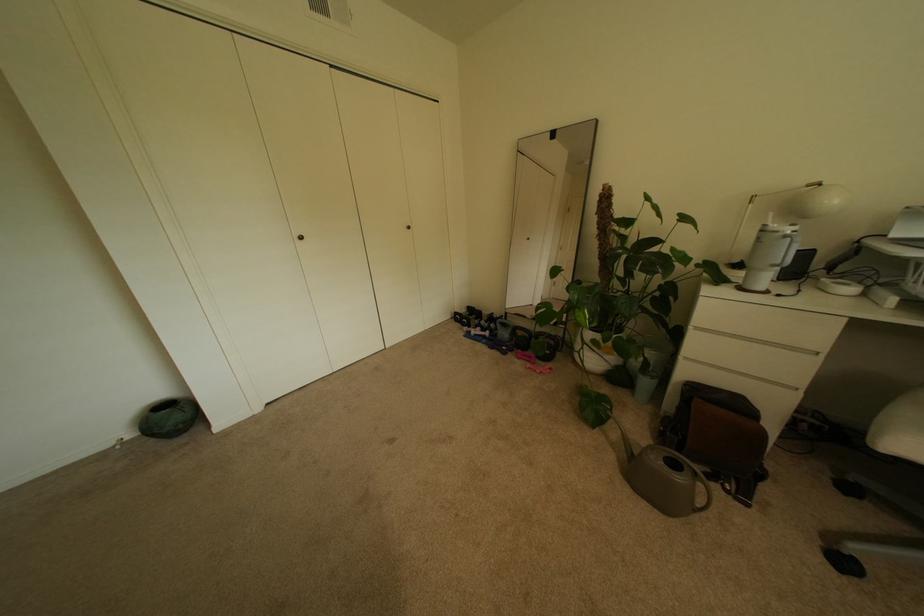
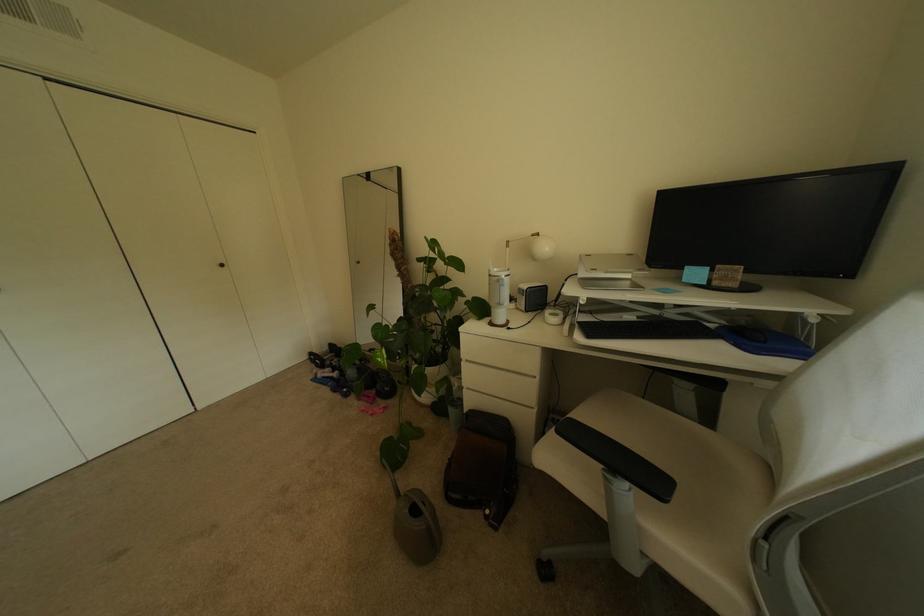
Question: In a continuous first-person perspective shot, in which direction is the camera moving?

Choices:
 (A) Left
 (B) Right
 (C) Forward
 (D) Backward

Answer: (B)